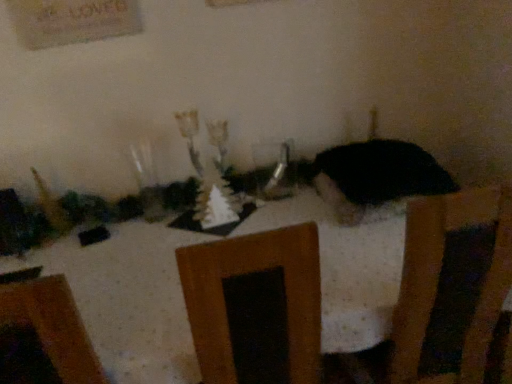
Question: Does black matte cat at center have a greater height compared to clear glass vase at center?

Choices:
 (A) yes
 (B) no

Answer: (B)

Question: Is the depth of black matte cat at center greater than that of clear glass vase at center?

Choices:
 (A) yes
 (B) no

Answer: (B)

Question: Is black matte cat at center closer to the viewer compared to clear glass vase at center?

Choices:
 (A) no
 (B) yes

Answer: (B)

Question: Does black matte cat at center turn towards clear glass vase at center?

Choices:
 (A) yes
 (B) no

Answer: (B)

Question: Is black matte cat at center positioned with its back to clear glass vase at center?

Choices:
 (A) yes
 (B) no

Answer: (B)

Question: Is white dotted tablecloth at center wider or thinner than clear glass vase at center?

Choices:
 (A) thin
 (B) wide

Answer: (B)

Question: From a real-world perspective, is white dotted tablecloth at center physically located above or below clear glass vase at center?

Choices:
 (A) below
 (B) above

Answer: (A)

Question: Is white dotted tablecloth at center bigger or smaller than clear glass vase at center?

Choices:
 (A) big
 (B) small

Answer: (A)

Question: From their relative heights in the image, would you say white dotted tablecloth at center is taller or shorter than clear glass vase at center?

Choices:
 (A) tall
 (B) short

Answer: (A)

Question: Is point (342, 190) closer or farther from the camera than point (287, 162)?

Choices:
 (A) farther
 (B) closer

Answer: (B)

Question: Is black matte cat at center wider or thinner than clear glass vase at center?

Choices:
 (A) wide
 (B) thin

Answer: (A)

Question: Choose the correct answer: Is black matte cat at center inside clear glass vase at center or outside it?

Choices:
 (A) inside
 (B) outside

Answer: (B)

Question: Visually, is black matte cat at center positioned to the left or to the right of clear glass vase at center?

Choices:
 (A) left
 (B) right

Answer: (B)

Question: From their relative heights in the image, would you say black matte cat at center is taller or shorter than white dotted tablecloth at center?

Choices:
 (A) short
 (B) tall

Answer: (A)

Question: Would you say black matte cat at center is to the left or to the right of white dotted tablecloth at center in the picture?

Choices:
 (A) left
 (B) right

Answer: (B)